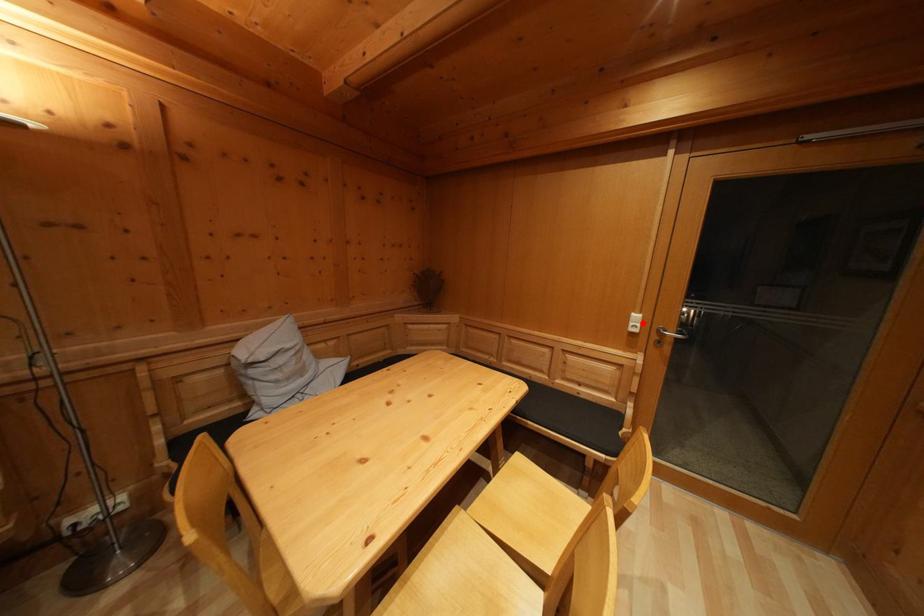
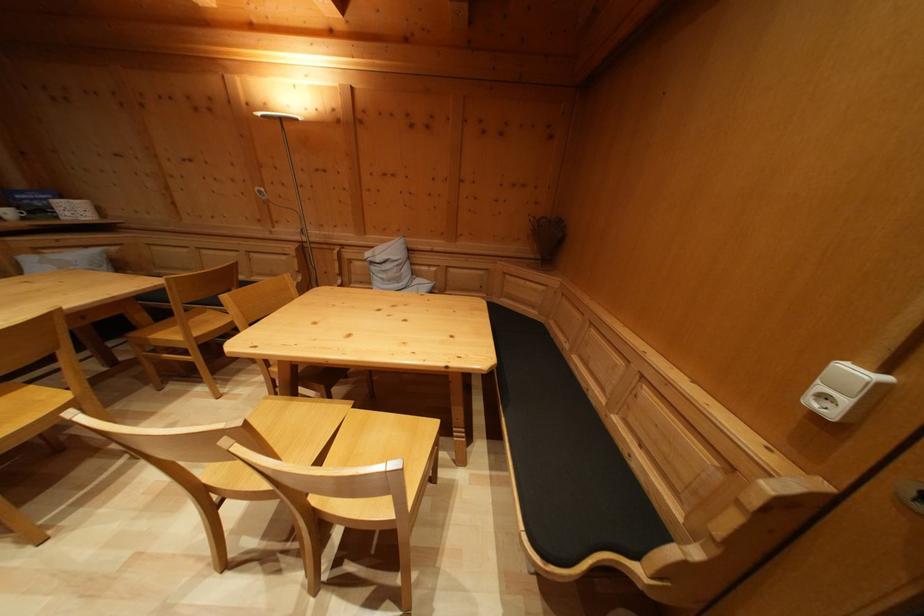
Locate, in the second image, the point that corresponds to the highlighted location in the first image.

(859, 379)